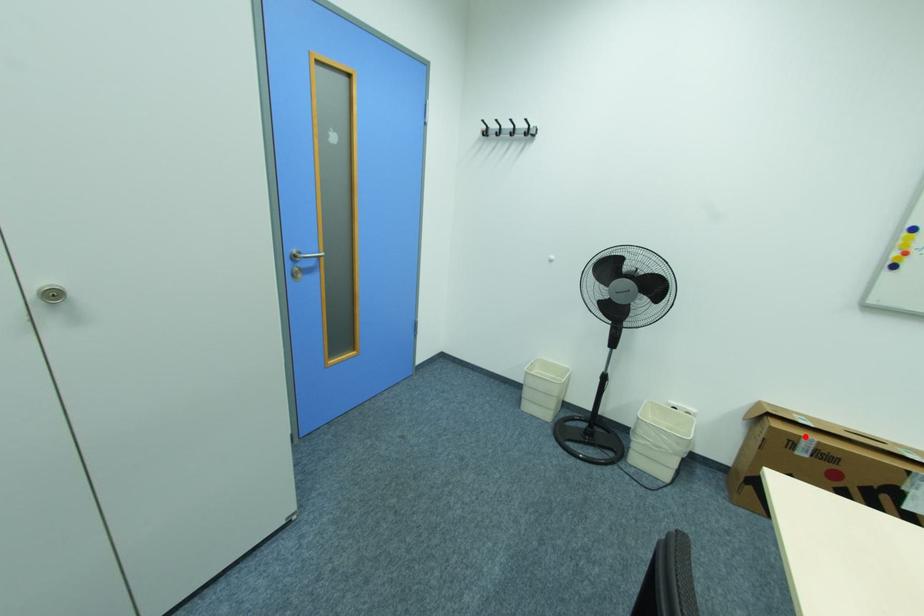
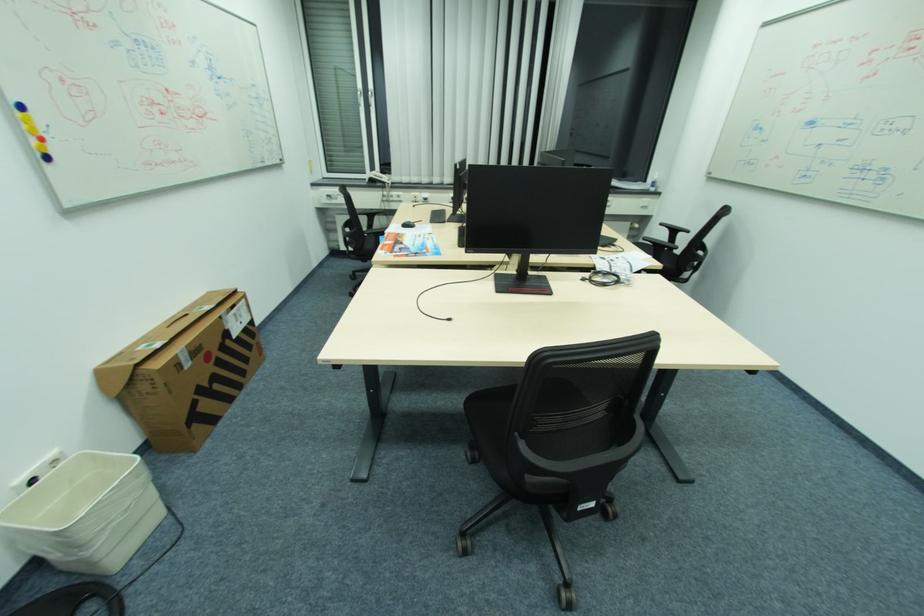
Question: I am providing you with two images of the same scene from different viewpoints. A red point is shown in image1. For the corresponding object point in image2, is it positioned nearer or farther from the camera?

Choices:
 (A) Nearer
 (B) Farther

Answer: (A)